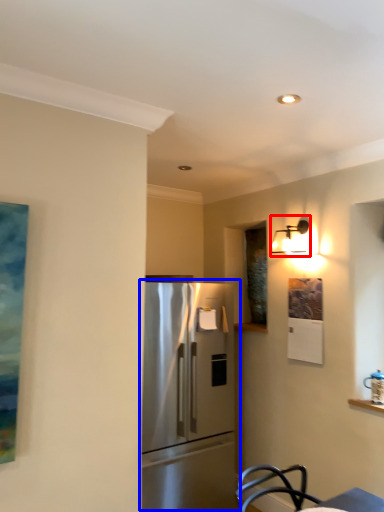
Question: Which object is closer to the camera taking this photo, light fixture (highlighted by a red box) or refrigerator (highlighted by a blue box)?

Choices:
 (A) light fixture
 (B) refrigerator

Answer: (B)